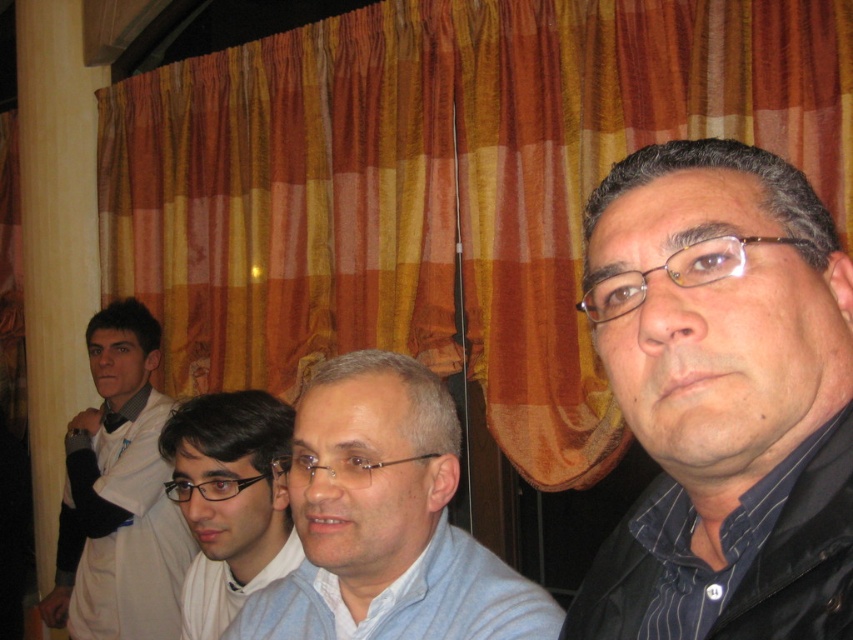
You are a photographer setting up for a group photo. You notice the light blue fabric shirt at center and the clear plastic glasses at center in the frame. Which object should you adjust to ensure both are fully visible in the photo?

The clear plastic glasses at center should be adjusted because the light blue fabric shirt at center is taller than the clear plastic glasses at center, so the glasses might be partially hidden by the shirt in the frame.

You are standing in front of the image and want to know the position of the white shirt at left relative to the curtain with a warm striped pattern. Can you determine if it is to the left or right of the curtain?

The white shirt at left is located at point (119, 496), which is to the left side of the curtain with a warm striped pattern.

You are organizing a photoshoot and need to ensure that the orange striped curtain at upper center and the white shirt at left are both visible in the frame. Given their sizes, which object should you prioritize positioning closer to the camera to maintain clarity and detail?

The orange striped curtain at upper center is larger in size than the white shirt at left, so you should prioritize positioning the white shirt at left closer to the camera to ensure its details are clear, as smaller objects may require closer framing for visibility.